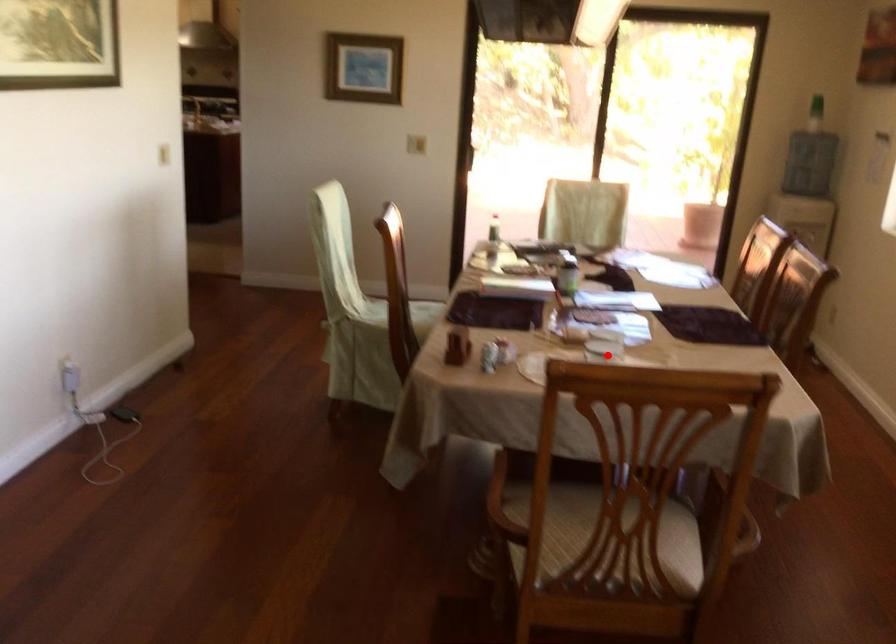
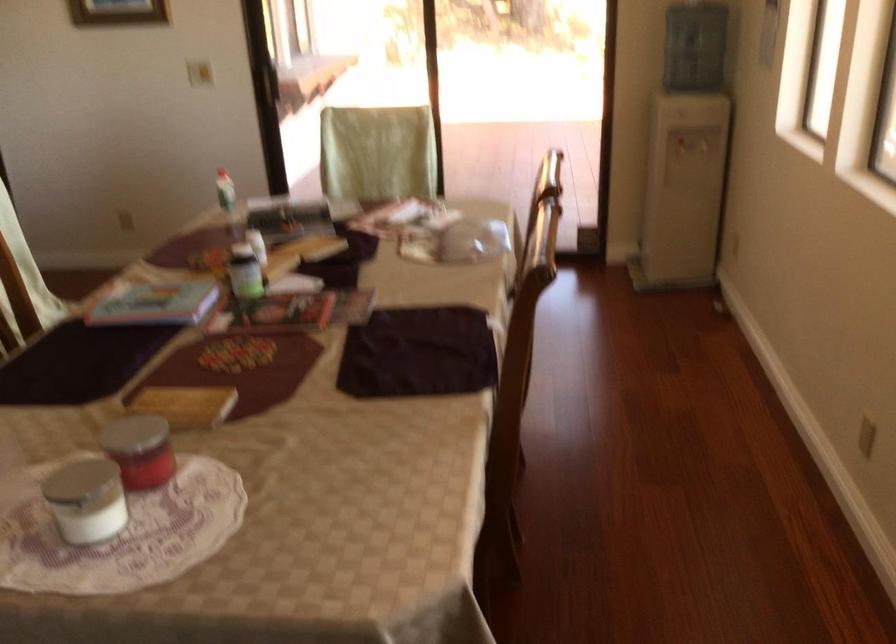
Question: A red point is marked in image1. In image2, is the corresponding 3D point closer to the camera or farther? Reply with the corresponding letter.

Choices:
 (A) The corresponding 3D point is closer.
 (B) The corresponding 3D point is farther.

Answer: (A)